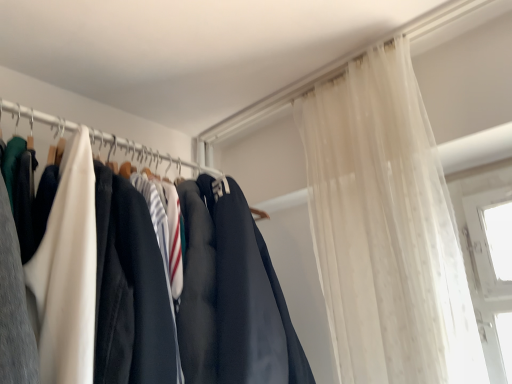
Question: Is matte black clothing at left shorter than sheer white curtain at upper right?

Choices:
 (A) no
 (B) yes

Answer: (B)

Question: Is matte black clothing at left surrounding sheer white curtain at upper right?

Choices:
 (A) no
 (B) yes

Answer: (A)

Question: Can you confirm if matte black clothing at left is taller than sheer white curtain at upper right?

Choices:
 (A) yes
 (B) no

Answer: (B)

Question: Can you confirm if matte black clothing at left is wider than sheer white curtain at upper right?

Choices:
 (A) no
 (B) yes

Answer: (A)

Question: Considering the relative positions of matte black clothing at left and sheer white curtain at upper right in the image provided, is matte black clothing at left to the left of sheer white curtain at upper right from the viewer's perspective?

Choices:
 (A) yes
 (B) no

Answer: (A)

Question: Is matte black clothing at left at the right side of sheer white curtain at upper right?

Choices:
 (A) yes
 (B) no

Answer: (B)

Question: Can you confirm if sheer white curtain at upper right is shorter than matte black clothing at left?

Choices:
 (A) no
 (B) yes

Answer: (A)

Question: Considering the relative sizes of sheer white curtain at upper right and matte black clothing at left in the image provided, is sheer white curtain at upper right wider than matte black clothing at left?

Choices:
 (A) yes
 (B) no

Answer: (A)

Question: Can matte black clothing at left be found inside sheer white curtain at upper right?

Choices:
 (A) yes
 (B) no

Answer: (B)

Question: Is sheer white curtain at upper right positioned before matte black clothing at left?

Choices:
 (A) no
 (B) yes

Answer: (B)

Question: From a real-world perspective, is sheer white curtain at upper right positioned over matte black clothing at left based on gravity?

Choices:
 (A) no
 (B) yes

Answer: (A)

Question: From the image's perspective, is sheer white curtain at upper right over matte black clothing at left?

Choices:
 (A) yes
 (B) no

Answer: (B)

Question: Considering the positions of sheer white curtain at upper right and matte black clothing at left in the image, is sheer white curtain at upper right bigger or smaller than matte black clothing at left?

Choices:
 (A) small
 (B) big

Answer: (B)